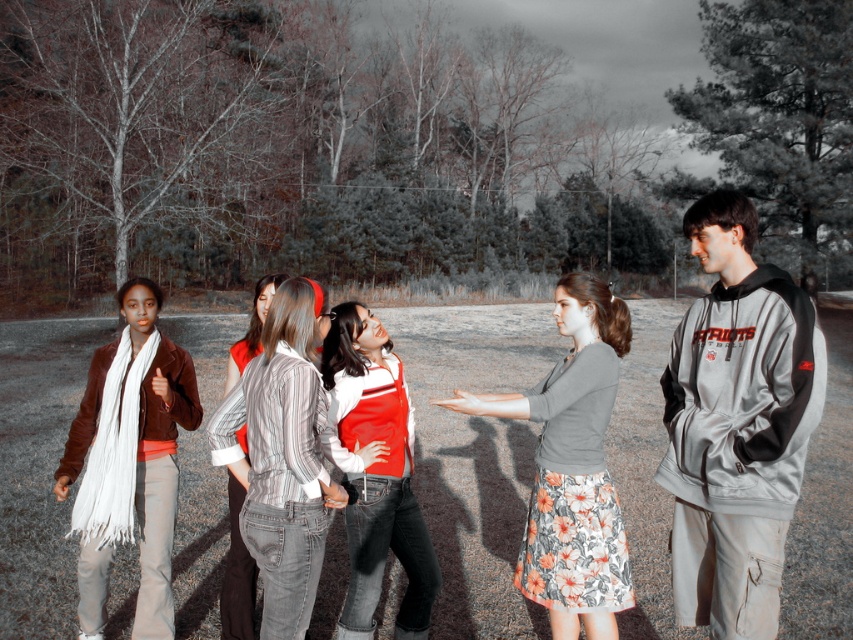
Can you confirm if floral cotton skirt at center is shorter than red and white striped sweater at center?

Incorrect, floral cotton skirt at center's height does not fall short of red and white striped sweater at center's.

Is point (608, 481) less distant than point (390, 442)?

Yes, point (608, 481) is closer to viewer.

Is point (596, 288) positioned after point (355, 611)?

No.

Image resolution: width=853 pixels, height=640 pixels. I want to click on floral cotton skirt at center, so coord(572,467).

Does gray hoodie at right appear under matte brown jacket at left?

No.

Which is in front, point (730, 301) or point (161, 342)?

Point (730, 301)

The width and height of the screenshot is (853, 640). In order to click on gray hoodie at right in this screenshot , I will do 735,424.

Between gray hoodie at right and striped cotton shirt at center, which one has less height?

gray hoodie at right is shorter.

Can you confirm if gray hoodie at right is thinner than striped cotton shirt at center?

Yes.

Find the location of a particular element. gray hoodie at right is located at coordinates (735, 424).